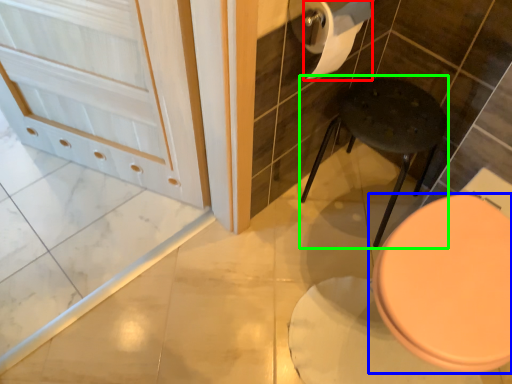
Question: Which is farther away from toilet paper (highlighted by a red box)? toilet (highlighted by a blue box) or bar stool (highlighted by a green box)?

Choices:
 (A) toilet
 (B) bar stool

Answer: (A)